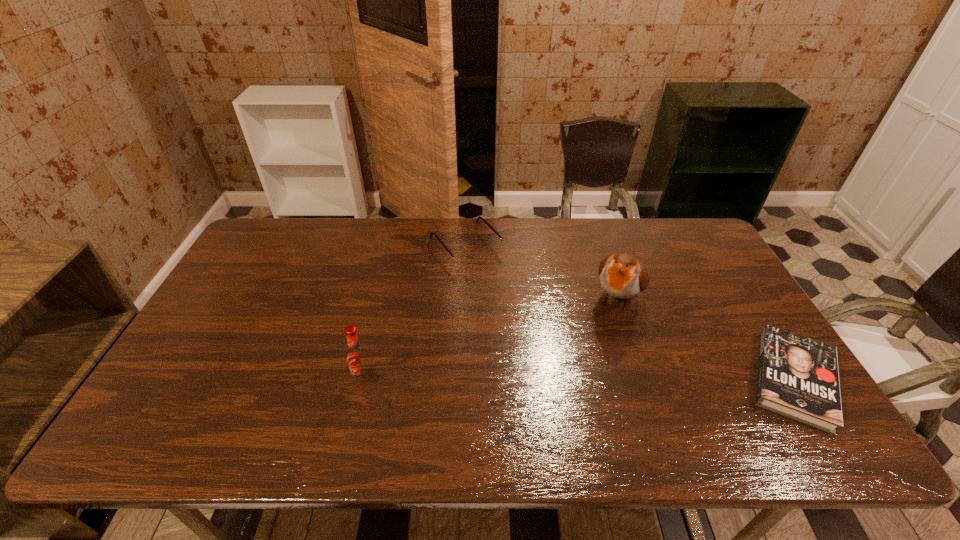
Identify the location of free space on the desktop that is between the leftmost object and the rightmost object and is positioned at the face of the second farthest object. The width and height of the screenshot is (960, 540). (573, 380).

Where is `vacant spot on the desktop that is between the leftmost object and the book and is positioned at the hinge ends of the second shortest object`? vacant spot on the desktop that is between the leftmost object and the book and is positioned at the hinge ends of the second shortest object is located at coordinates (585, 380).